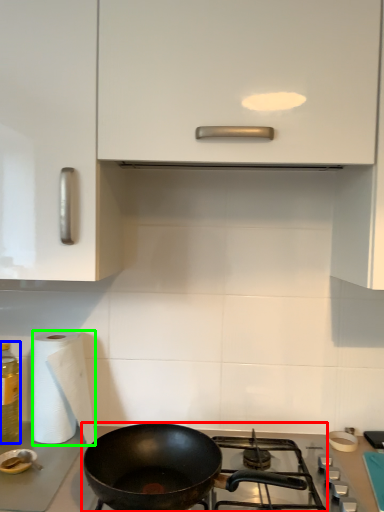
Question: Based on their relative distances, which object is farther from gas stove (highlighted by a red box)? Choose from bottle (highlighted by a blue box) and paper towel (highlighted by a green box).

Choices:
 (A) bottle
 (B) paper towel

Answer: (A)